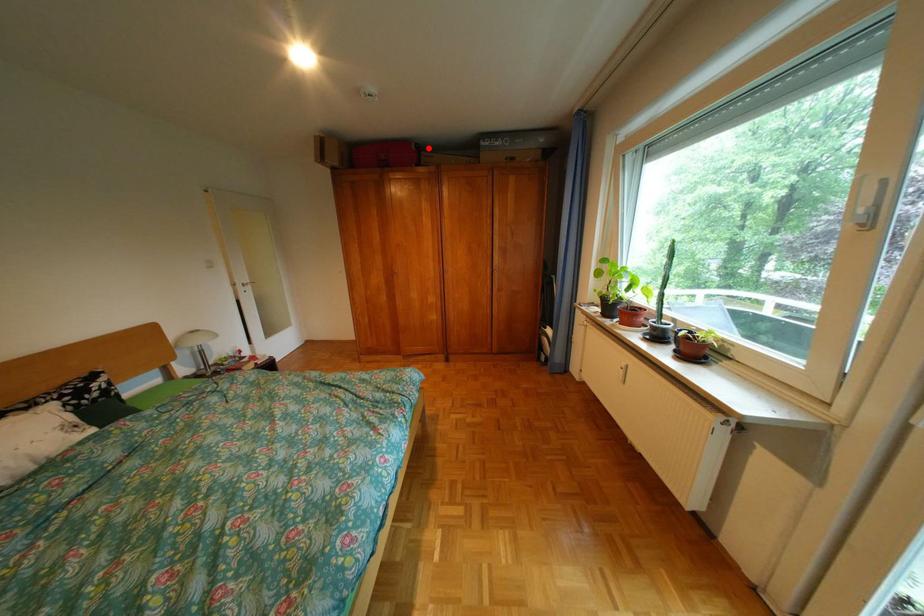
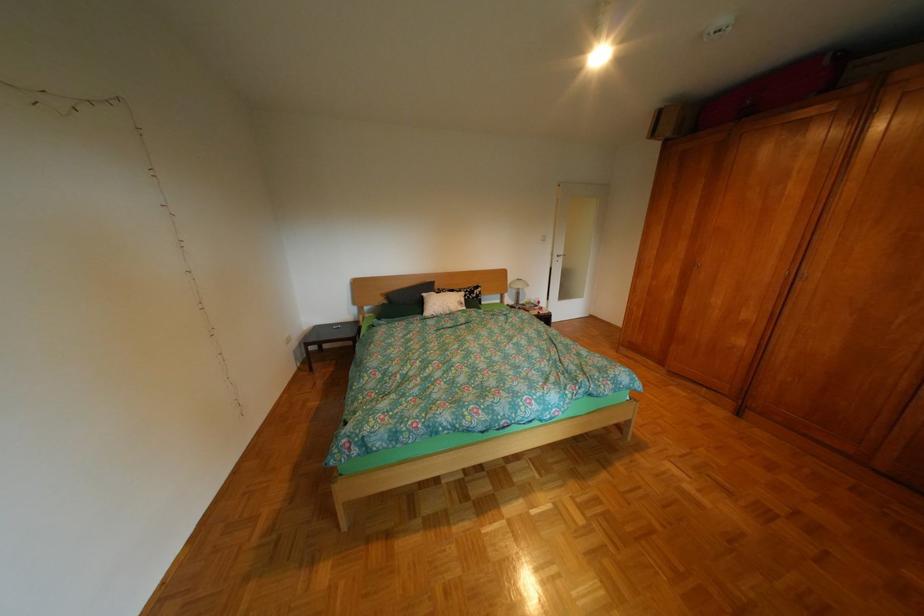
Find the pixel in the second image that matches the highlighted location in the first image.

(842, 63)